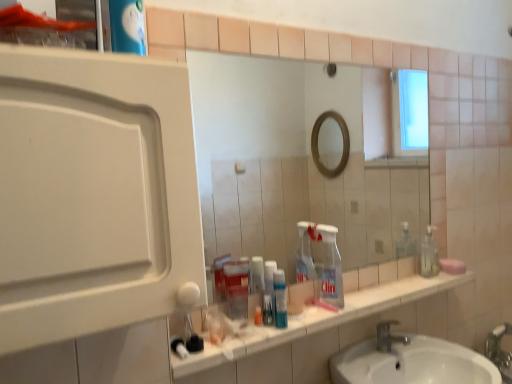
Where is `vacant area that lies to the right of silver metallic faucet at lower center`? This screenshot has width=512, height=384. vacant area that lies to the right of silver metallic faucet at lower center is located at coordinates (423, 343).